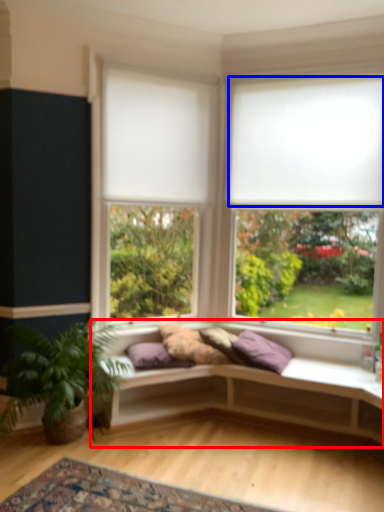
Question: Which object appears closest to the camera in this image, studio couch (highlighted by a red box) or blind (highlighted by a blue box)?

Choices:
 (A) studio couch
 (B) blind

Answer: (A)